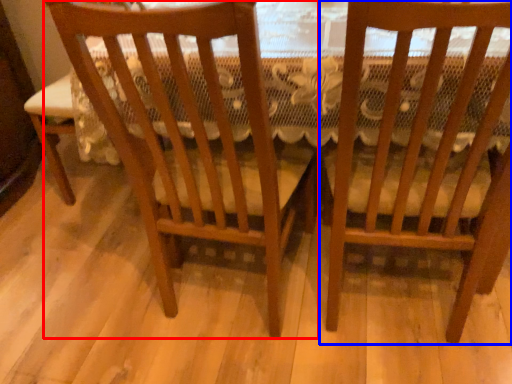
Question: Among these objects, which one is farthest to the camera, chair (highlighted by a red box) or chair (highlighted by a blue box)?

Choices:
 (A) chair
 (B) chair

Answer: (A)